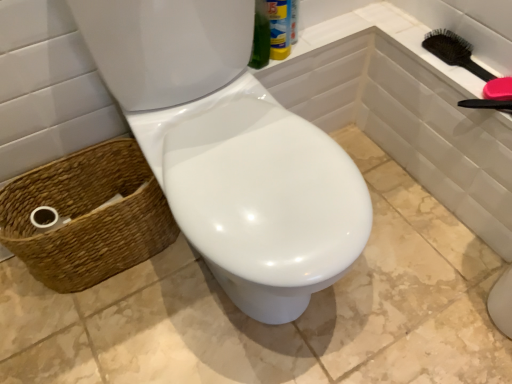
Question: Relative to black plastic hairbrush at upper right, is white glossy toilet at center in front or behind?

Choices:
 (A) front
 (B) behind

Answer: (A)

Question: From a real-world perspective, is white glossy toilet at center positioned above or below black plastic hairbrush at upper right?

Choices:
 (A) below
 (B) above

Answer: (A)

Question: Which of these objects is positioned closest to the black plastic hairbrush at upper right?

Choices:
 (A) white glossy toilet at center
 (B) woven brown basket at lower left

Answer: (A)

Question: Which object is positioned farthest from the woven brown basket at lower left?

Choices:
 (A) white glossy toilet at center
 (B) black plastic hairbrush at upper right

Answer: (B)